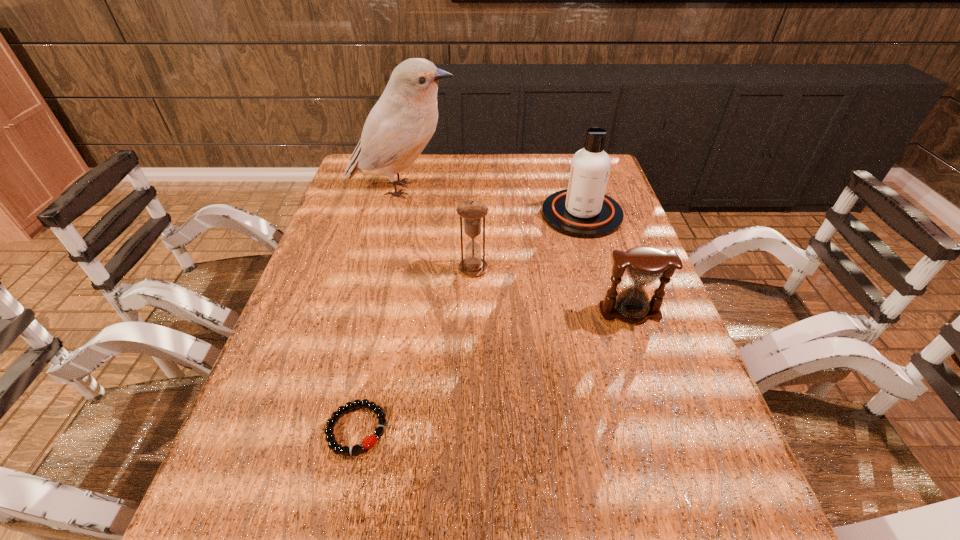
Find the location of a particular element. This screenshot has width=960, height=540. free region at the left edge of the desktop is located at coordinates click(x=255, y=507).

The width and height of the screenshot is (960, 540). What are the coordinates of `free space at the far right corner` in the screenshot? It's located at (567, 157).

I want to click on vacant point located between the second nearest object and the parakeet, so click(516, 251).

Locate an element on the screen. vacant area between the shortest object and the third farthest object is located at coordinates (415, 349).

Locate an element on the screen. Image resolution: width=960 pixels, height=540 pixels. free space between the nearest object and the nearer hourglass is located at coordinates (493, 370).

Where is `vacant space that's between the cleansing agent and the farther hourglass`? This screenshot has height=540, width=960. vacant space that's between the cleansing agent and the farther hourglass is located at coordinates (528, 241).

In order to click on empty location between the tallest object and the nearer hourglass in this screenshot , I will do `click(516, 251)`.

The image size is (960, 540). I want to click on free space between the left hourglass and the right hourglass, so click(x=551, y=290).

Where is `vacant area between the nearer hourglass and the parakeet`? vacant area between the nearer hourglass and the parakeet is located at coordinates (516, 251).

I want to click on vacant space in between the nearer hourglass and the left hourglass, so click(551, 290).